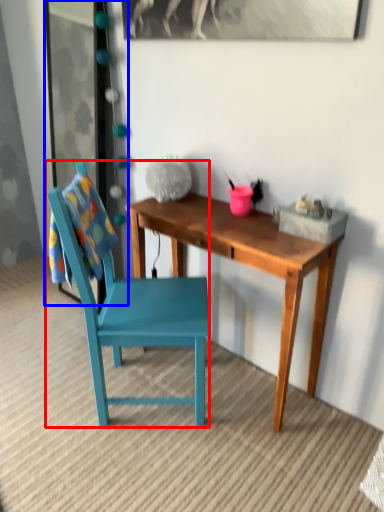
Question: Which point is closer to the camera, chair (highlighted by a red box) or glass door (highlighted by a blue box)?

Choices:
 (A) chair
 (B) glass door

Answer: (A)